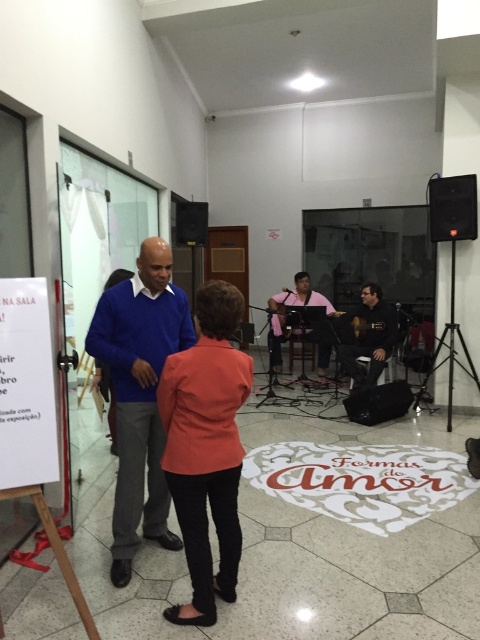
Is point (182, 440) positioned after point (144, 465)?

That is False.

Does matte orange blazer at center appear over blue sweater at center?

Actually, matte orange blazer at center is below blue sweater at center.

You are a GUI agent. You are given a task and a screenshot of the screen. Output one action in this format:
    pyautogui.click(x=<x>, y=<y>)
    Task: Click on the matte orange blazer at center
    The width and height of the screenshot is (480, 640).
    Given the screenshot: What is the action you would take?
    pyautogui.click(x=205, y=448)

The height and width of the screenshot is (640, 480). I want to click on matte orange blazer at center, so click(205, 448).

Can you confirm if blue sweater at center is thinner than matte pink shirt at center?

Indeed, blue sweater at center has a lesser width compared to matte pink shirt at center.

Can you confirm if blue sweater at center is shorter than matte pink shirt at center?

No.

Who is more distant from viewer, (152, 260) or (282, 305)?

The point (282, 305) is more distant.

Where is `blue sweater at center`? This screenshot has height=640, width=480. blue sweater at center is located at coordinates (140, 394).

Is blue sweater at center wider than black plastic speaker at upper center?

Indeed, blue sweater at center has a greater width compared to black plastic speaker at upper center.

Does blue sweater at center have a lesser height compared to black plastic speaker at upper center?

In fact, blue sweater at center may be taller than black plastic speaker at upper center.

Is point (121, 512) farther from viewer compared to point (191, 212)?

No, (121, 512) is closer to viewer.

Where is `blue sweater at center`? The image size is (480, 640). blue sweater at center is located at coordinates (140, 394).